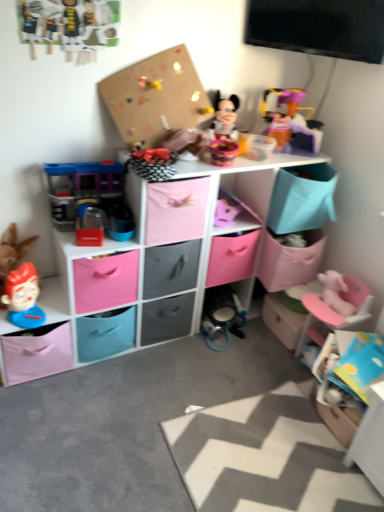
This screenshot has width=384, height=512. What are the coordinates of `vacant area that lies between pink fabric storage cubes at center and pink plastic swivel chair at lower right` in the screenshot? It's located at (200, 365).